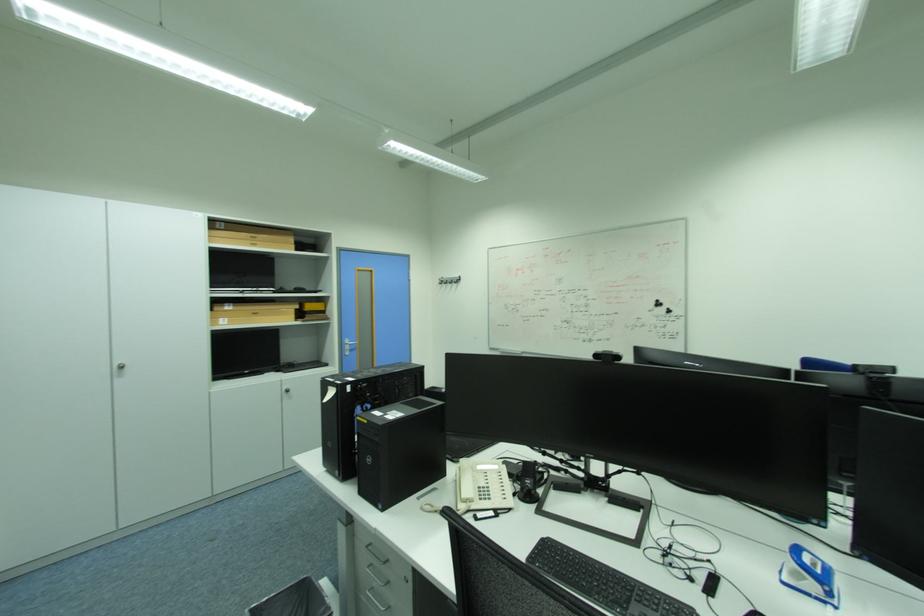
Locate an element on the screen. telephone handset is located at coordinates click(x=464, y=485).